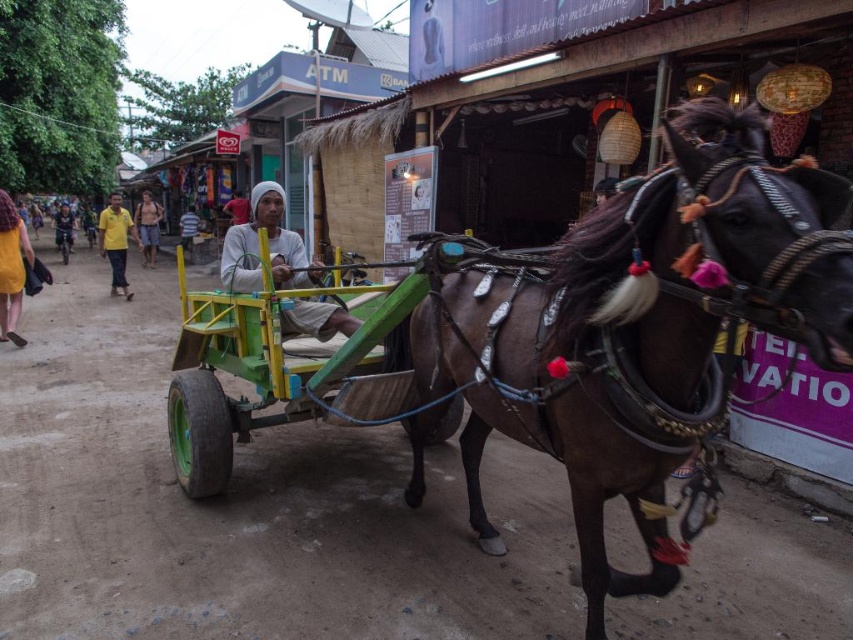
Question: Which of these objects is positioned farthest from the yellow fabric dress at lower left?

Choices:
 (A) white matte cloth at center
 (B) white fabric headscarf at center

Answer: (B)

Question: Is brown leather horse at center further to camera compared to yellow shirt at left?

Choices:
 (A) yes
 (B) no

Answer: (B)

Question: Is brown leather horse at center further to the viewer compared to yellow fabric dress at lower left?

Choices:
 (A) no
 (B) yes

Answer: (A)

Question: Can you confirm if yellow fabric dress at lower left is bigger than yellow shirt at left?

Choices:
 (A) no
 (B) yes

Answer: (A)

Question: Which point appears closest to the camera in this image?

Choices:
 (A) (99, 240)
 (B) (248, 202)

Answer: (B)

Question: Which object is closer to the camera taking this photo?

Choices:
 (A) white matte cloth at center
 (B) white striped shirt at center
 (C) white fabric headscarf at center

Answer: (A)